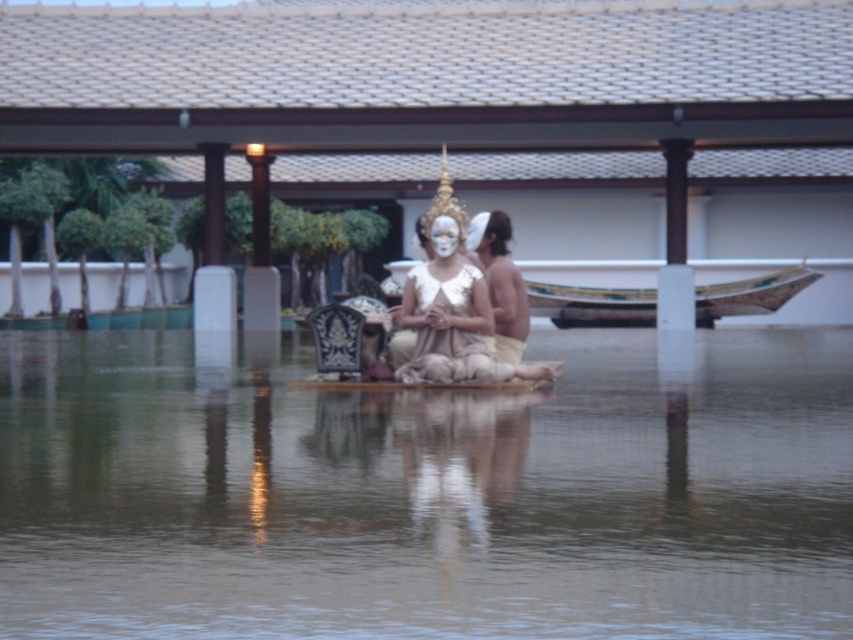
You are a photographer trying to capture the scene from the left side of the image. You want to ensure both the brown matte wood at center and the white matte face at center are visible in your shot. Which object should you position closer to the edge of your frame to achieve this?

Since the brown matte wood at center is to the left of white matte face at center, you should position the brown matte wood at center closer to the left edge of your frame to ensure both objects are visible.

You are a photographer trying to capture the scene from a low angle. You notice the brown matte wood at center and the white matte face at center. Which object would appear bigger in your photo?

The brown matte wood at center has a larger size compared to the white matte face at center, so it would appear bigger in the photo.